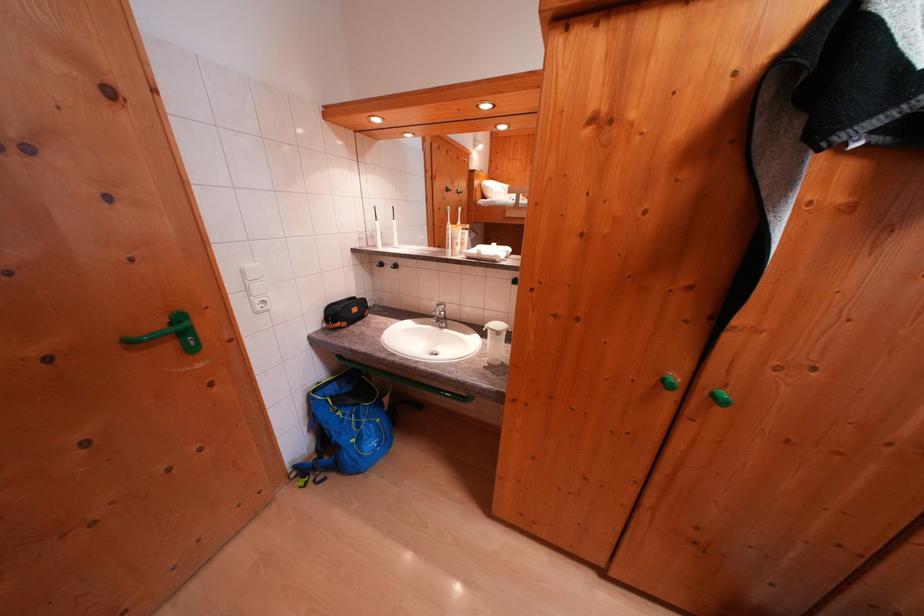
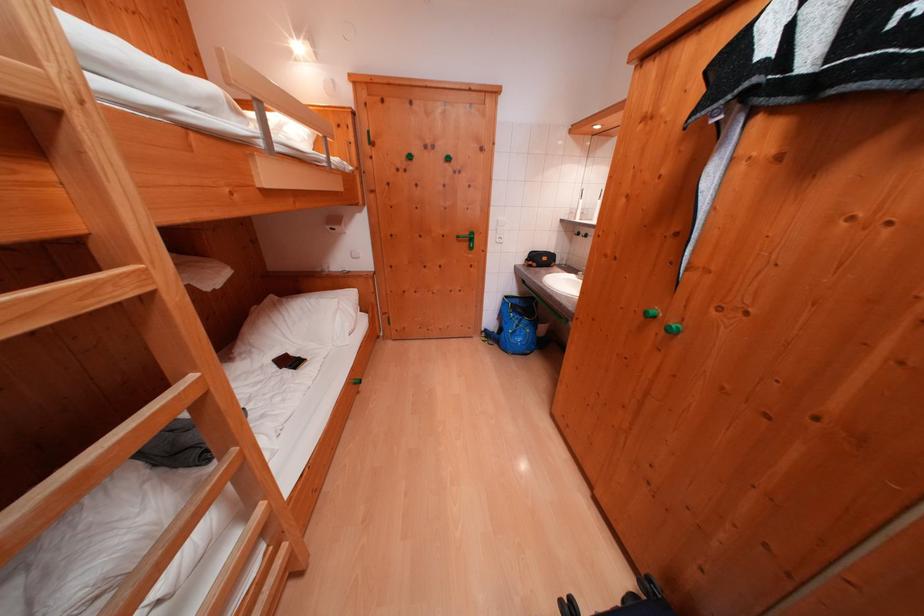
The point at (x=322, y=395) is marked in the first image. Where is the corresponding point in the second image?

(515, 301)